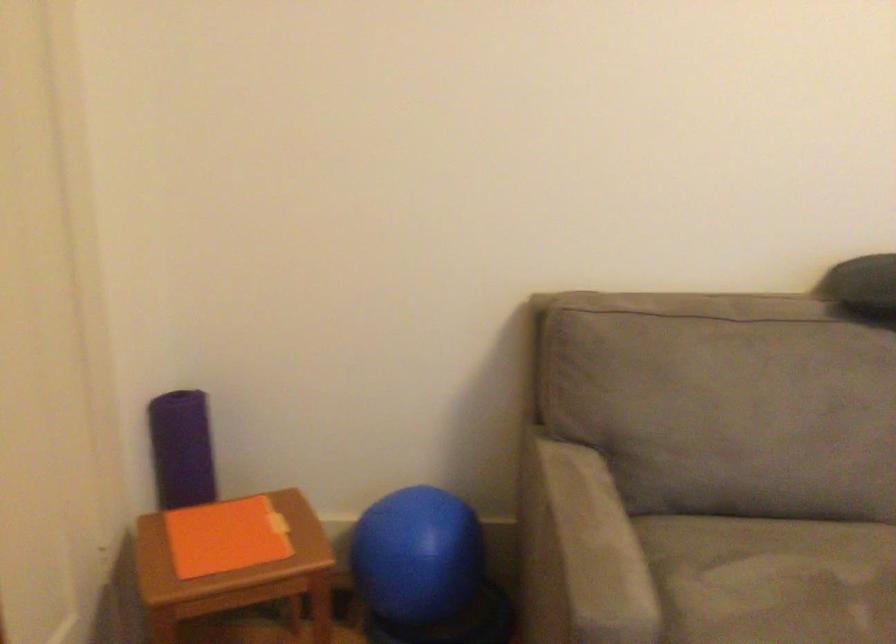
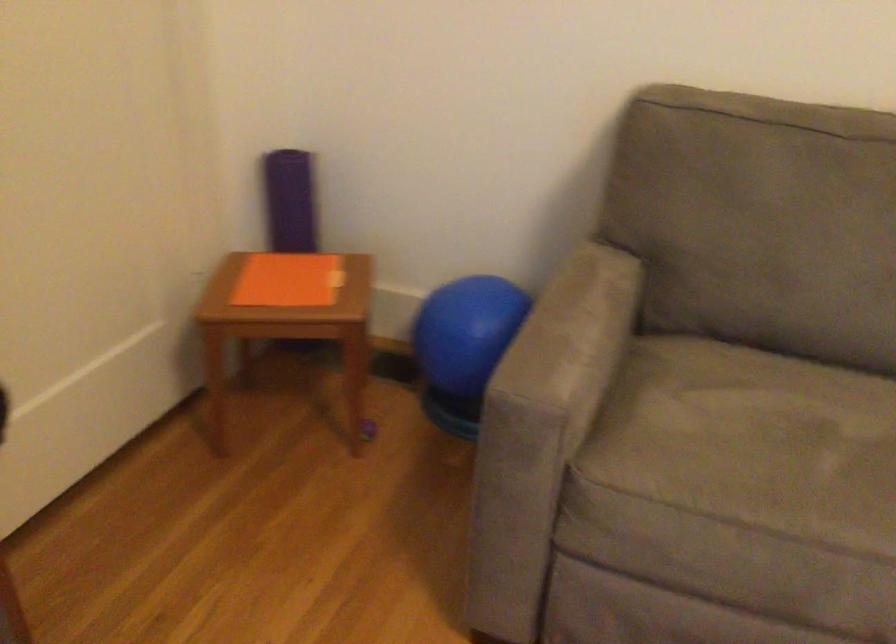
Find the pixel in the second image that matches the point at 197,446 in the first image.

(289, 201)